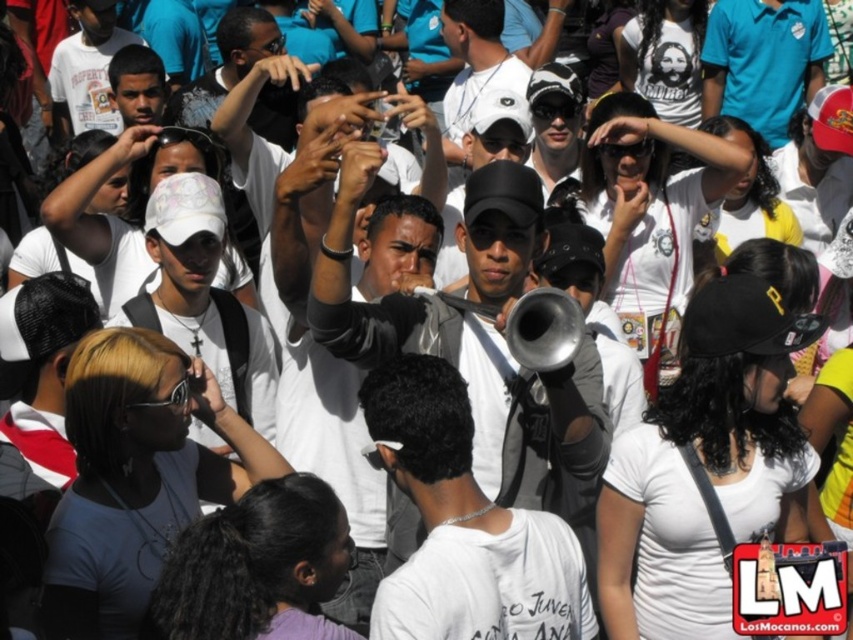
Based on the photo, you are a photographer at the event and want to capture both the white matte cap at center and the shiny silver trumpet at center in a single photo. Which object should you focus on first to ensure both are in frame?

The white matte cap at center is much taller than the shiny silver trumpet at center, so focusing on the white matte cap at center first will ensure both are in frame.

You are a photographer at the event and want to capture both the white matte cap at center and the shiny silver trumpet at center in a single frame. Which object should you focus on first to ensure both are in the frame?

The white matte cap at center is bigger than the shiny silver trumpet at center, so you should focus on the white matte cap at center first to ensure both fit within the frame.

You are a photographer at the event and need to capture both the white matte cap at center and the shiny silver trumpet at center in a single frame. Which object should you zoom in on to ensure both are clearly visible without cropping?

The white matte cap at center is wider than the shiny silver trumpet at center. To capture both clearly, you should zoom in on the wider object, which is the white matte cap at center, ensuring both fit within the frame.